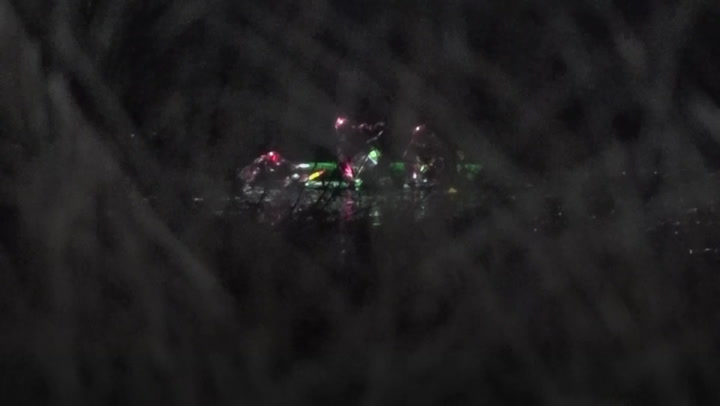
Where is `pink lights`? The image size is (720, 406). pink lights is located at coordinates (271, 154), (343, 171), (340, 121), (422, 128).